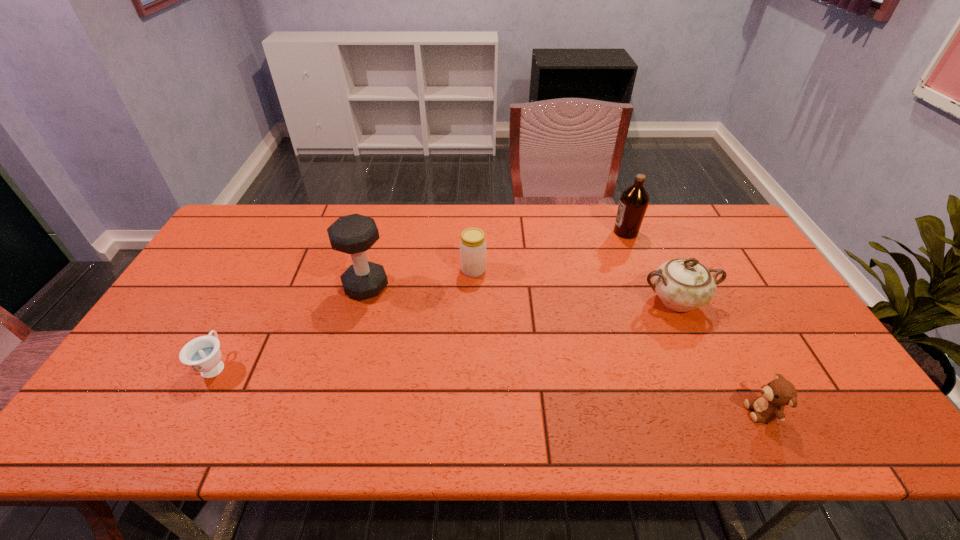
I want to click on vacant point located on the label of the olive oil, so click(537, 232).

Find the location of a particular element. free space located 0.250m on the label of the olive oil is located at coordinates (540, 232).

Find the location of a particular element. Image resolution: width=960 pixels, height=540 pixels. vacant space located 0.390m on the label of the olive oil is located at coordinates (498, 232).

This screenshot has height=540, width=960. Identify the location of vacant space located 0.250m on the back of the chinaware. (645, 232).

Identify the location of free space located 0.280m on the front of the fourth tallest object. (472, 353).

Locate an element on the screen. Image resolution: width=960 pixels, height=540 pixels. vacant space located on the face of the second shortest object is located at coordinates (642, 412).

Identify the location of vacant area situated on the face of the second shortest object. (660, 412).

Where is `vacant space located 0.210m on the face of the second shortest object`? The width and height of the screenshot is (960, 540). vacant space located 0.210m on the face of the second shortest object is located at coordinates (656, 412).

I want to click on vacant region located on the side of the teacup with the handle, so click(x=268, y=266).

The width and height of the screenshot is (960, 540). In order to click on vacant space located on the side of the teacup with the handle in this screenshot , I will do `click(240, 318)`.